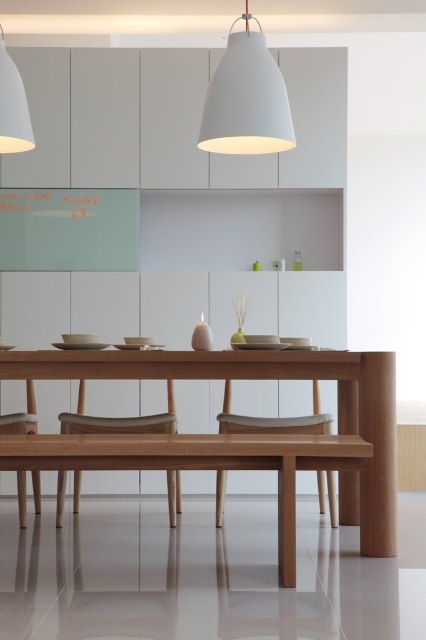
You are a painter standing at the edge of the dining area. You want to paint the matte white pendant lamp at upper center without moving the natural wood table at center. Can you reach the lamp if your maximum arm extension is 1.5 meters?

The natural wood table at center and matte white pendant lamp at upper center are 1.74 meters apart. Since your maximum arm extension is only 1.5 meters, you cannot reach the matte white pendant lamp at upper center from your current position.